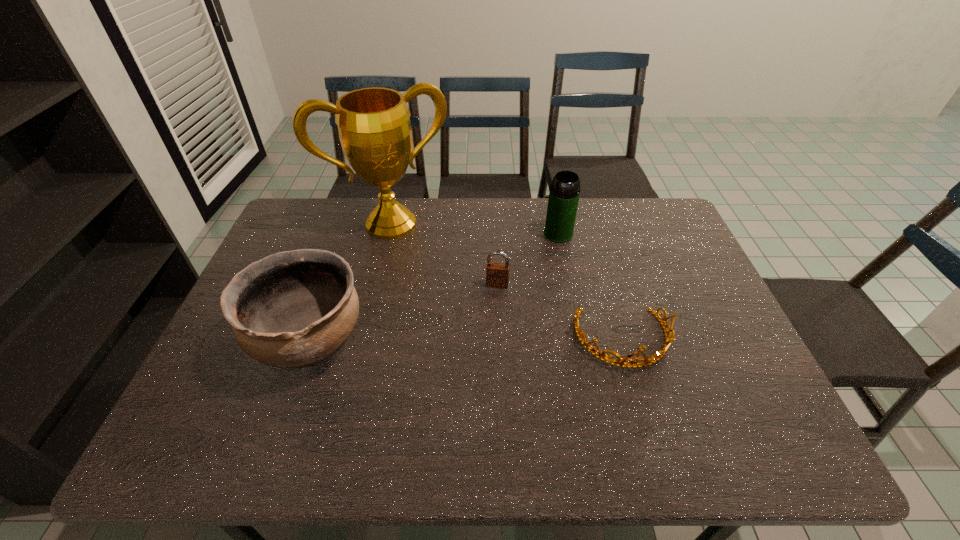
Locate an element on the screen. pottery is located at coordinates (293, 309).

Identify the location of tiara. click(x=669, y=338).

The image size is (960, 540). I want to click on thermos bottle, so click(x=564, y=193).

This screenshot has width=960, height=540. I want to click on award, so click(374, 127).

Identify the location of the third nearest object. The width and height of the screenshot is (960, 540). (497, 274).

Find the location of a particular element. The image size is (960, 540). the third object from left to right is located at coordinates (497, 274).

Find the location of `free space located 0.110m on the back of the pottery`. free space located 0.110m on the back of the pottery is located at coordinates pos(333,272).

What are the coordinates of `free location located 0.080m on the front-facing side of the shortest object` in the screenshot? It's located at (642, 404).

I want to click on vacant region located from the spout of the second tallest object, so click(537, 274).

Locate an element on the screen. vacant space located from the spout of the second tallest object is located at coordinates (541, 265).